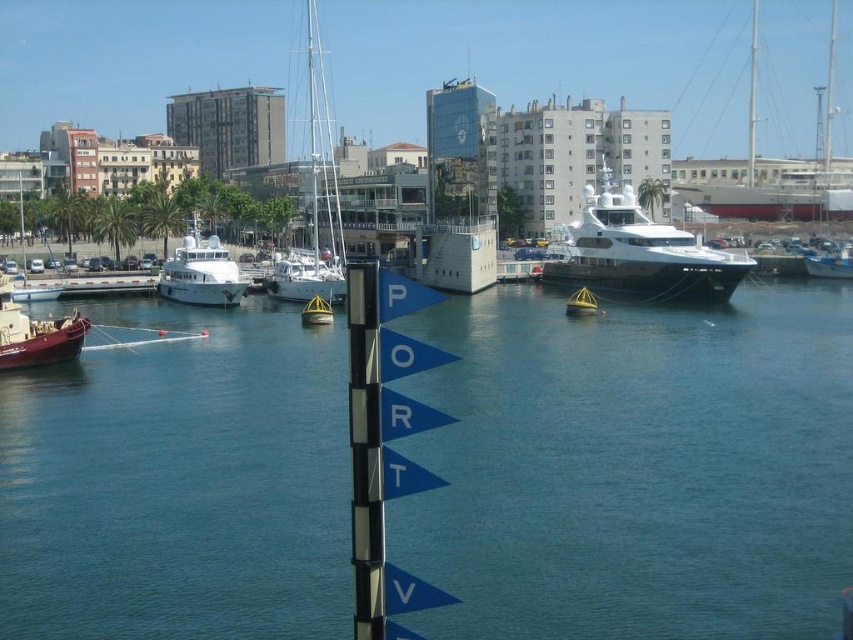
Between point (561, 614) and point (206, 280), which one is positioned in front?

Point (561, 614) is in front.

Identify the location of blue water at center. (634, 467).

This screenshot has width=853, height=640. Identify the location of blue water at center. pyautogui.click(x=634, y=467).

Between blue water at center and white glossy sailboat at center, which one is positioned higher?

Positioned higher is white glossy sailboat at center.

Can you confirm if blue water at center is wider than white glossy sailboat at center?

Indeed, blue water at center has a greater width compared to white glossy sailboat at center.

Is point (506, 540) in front of point (318, 205)?

That is True.

Locate an element on the screen. The height and width of the screenshot is (640, 853). blue water at center is located at coordinates (634, 467).

Is blue water at center closer to camera compared to shiny gold buoy at center?

Yes, blue water at center is in front of shiny gold buoy at center.

Which is below, blue water at center or shiny gold buoy at center?

Positioned lower is blue water at center.

Locate an element on the screen. This screenshot has width=853, height=640. blue water at center is located at coordinates (634, 467).